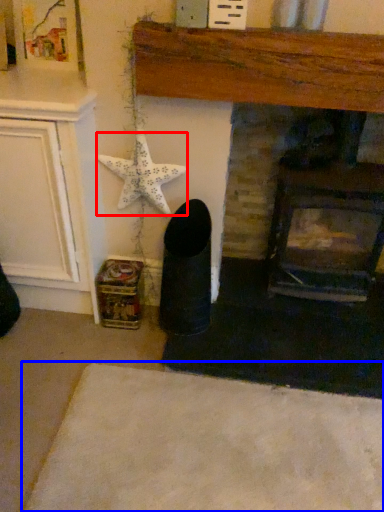
Question: Which of the following is the farthest to the observer, starfish (highlighted by a red box) or plain (highlighted by a blue box)?

Choices:
 (A) starfish
 (B) plain

Answer: (A)